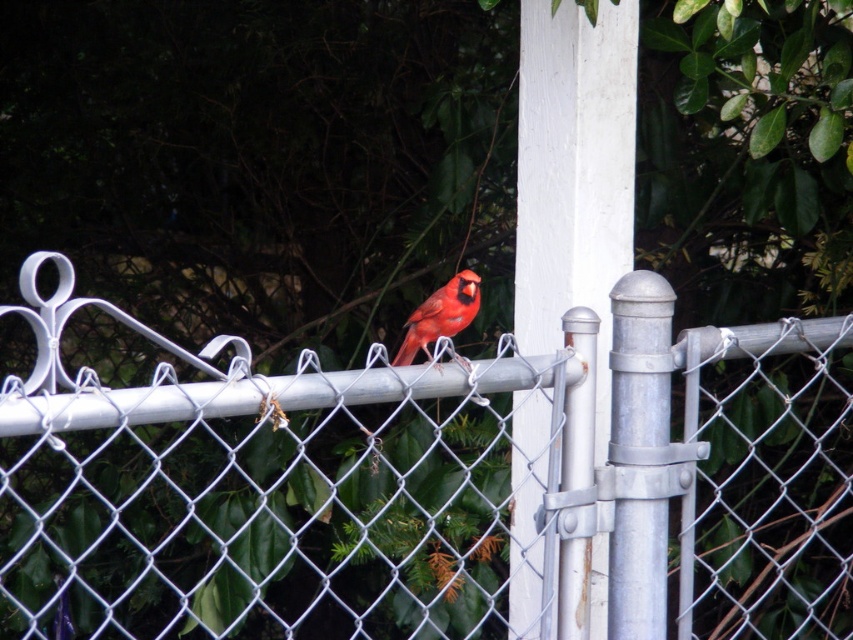
Question: Can you confirm if metallic silver fence at center is positioned above galvanized metal post at center-right?

Choices:
 (A) yes
 (B) no

Answer: (B)

Question: Which point is farther to the camera?

Choices:
 (A) (526, 177)
 (B) (456, 298)
 (C) (618, 442)
 (D) (660, 509)

Answer: (A)

Question: Is white metallic pole at center to the right of galvanized metal post at center-right from the viewer's perspective?

Choices:
 (A) yes
 (B) no

Answer: (B)

Question: Which of the following is the closest to the observer?

Choices:
 (A) white metallic pole at center
 (B) matte red cardinal at center

Answer: (A)

Question: Considering the real-world distances, which object is closest to the white metallic pole at center?

Choices:
 (A) matte red cardinal at center
 (B) galvanized metal post at center-right

Answer: (A)

Question: Is metallic silver fence at center thinner than white metallic pole at center?

Choices:
 (A) no
 (B) yes

Answer: (A)